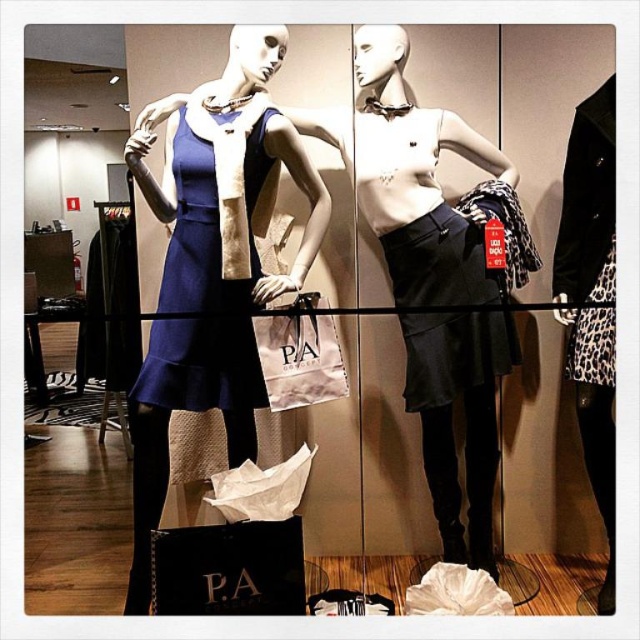
Can you confirm if matte black skirt at center is positioned to the right of matte white paper bag at center?

Yes, matte black skirt at center is to the right of matte white paper bag at center.

Is point (493, 298) closer to camera compared to point (282, 387)?

No, (493, 298) is behind (282, 387).

Where is `matte black skirt at center`? matte black skirt at center is located at coordinates (417, 180).

Which is below, matte blue dress at center or matte white paper bag at center?

matte white paper bag at center

Does matte blue dress at center have a smaller size compared to matte white paper bag at center?

Incorrect, matte blue dress at center is not smaller in size than matte white paper bag at center.

Is point (154, 186) closer to camera compared to point (294, 324)?

Yes.

Find the location of a particular element. The width and height of the screenshot is (640, 640). matte blue dress at center is located at coordinates (209, 300).

Which is in front, point (228, 68) or point (493, 371)?

Positioned in front is point (228, 68).

Is point (164, 376) less distant than point (512, 349)?

That is True.

Where is `matte blue dress at center`? This screenshot has width=640, height=640. matte blue dress at center is located at coordinates (209, 300).